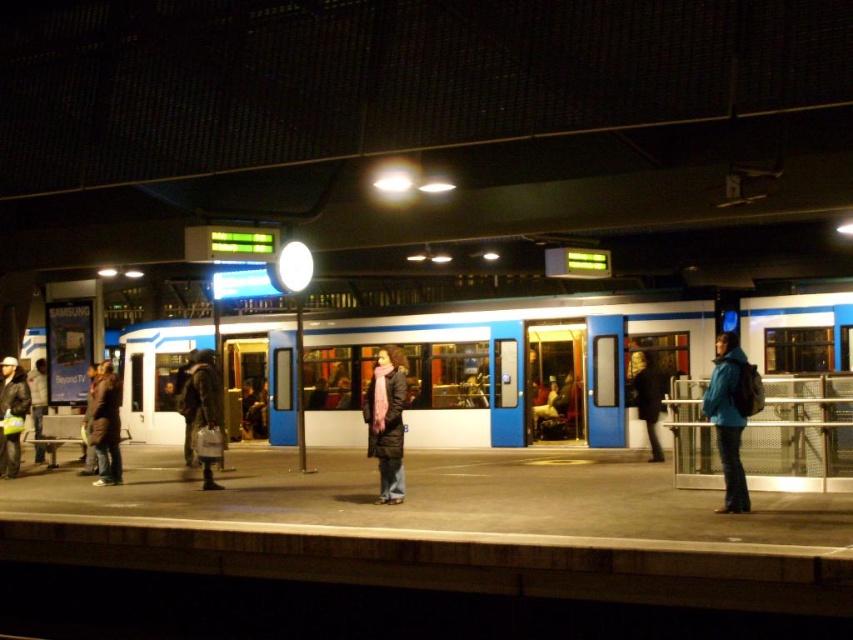
Does blue/white train at center lie behind dark blue jacket at center?

No, blue/white train at center is closer to the viewer.

Who is shorter, blue/white train at center or dark blue jacket at center?

Standing shorter between the two is dark blue jacket at center.

This screenshot has height=640, width=853. Find the location of `blue/white train at center`. blue/white train at center is located at coordinates (503, 365).

Where is `blue/white train at center`? The width and height of the screenshot is (853, 640). blue/white train at center is located at coordinates (503, 365).

Is blue/white train at center wider than teal matte jacket at right?

Correct, the width of blue/white train at center exceeds that of teal matte jacket at right.

Which of these two, blue/white train at center or teal matte jacket at right, stands shorter?

teal matte jacket at right is shorter.

This screenshot has height=640, width=853. Identify the location of blue/white train at center. point(503,365).

Identify the location of blue/white train at center. This screenshot has height=640, width=853. (503, 365).

Is blue/white train at center thinner than matte black jacket at left?

No.

Between blue/white train at center and matte black jacket at left, which one is positioned lower?

matte black jacket at left

Measure the distance between blue/white train at center and camera.

blue/white train at center and camera are 31.23 feet apart.

Find the location of a particular element. blue/white train at center is located at coordinates (503, 365).